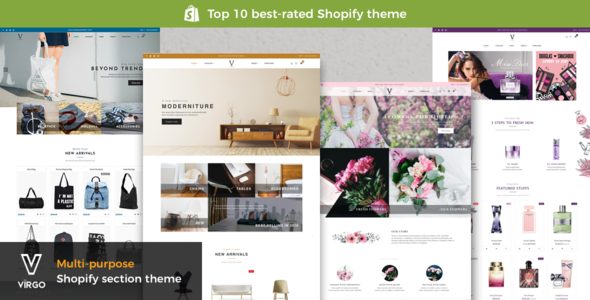
Find the location of `makeup`. makeup is located at coordinates [560, 81].